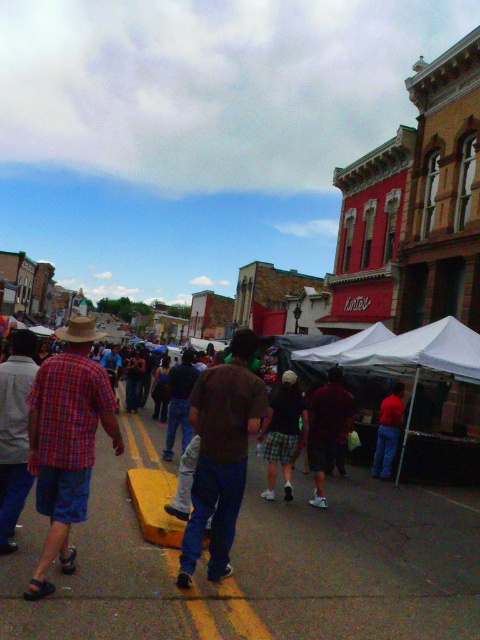
Question: Observing the image, what is the correct spatial positioning of brown fabric skateboard at center in reference to brown straw cowboy hat at center?

Choices:
 (A) right
 (B) left

Answer: (A)

Question: Which point appears farthest from the camera in this image?

Choices:
 (A) (224, 496)
 (B) (70, 332)

Answer: (A)

Question: Which of the following is the closest to the observer?

Choices:
 (A) (242, 426)
 (B) (83, 321)

Answer: (B)

Question: Does brown fabric skateboard at center have a greater width compared to brown straw cowboy hat at center?

Choices:
 (A) no
 (B) yes

Answer: (A)

Question: Is brown fabric skateboard at center below brown straw cowboy hat at center?

Choices:
 (A) yes
 (B) no

Answer: (A)

Question: Among these points, which one is nearest to the camera?

Choices:
 (A) (210, 548)
 (B) (84, 321)

Answer: (B)